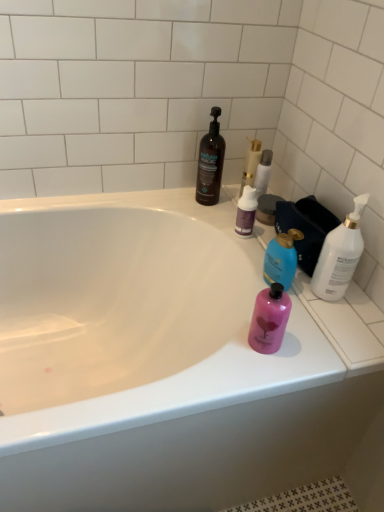
What do you see at coordinates (251, 164) in the screenshot? I see `gold metallic candle at upper center` at bounding box center [251, 164].

You are a GUI agent. You are given a task and a screenshot of the screen. Output one action in this format:
    pyautogui.click(x=<x>, y=<y>)
    Task: Click on the pink matte bottle at right, positioned as the third bottle in right-to-left order
    The image size is (384, 512).
    Given the screenshot: What is the action you would take?
    pyautogui.click(x=269, y=319)

Based on the photo, measure the distance between blue glossy bottle at upper right, the fourth bottle positioned from the left, and camera.

A distance of 39.30 inches exists between blue glossy bottle at upper right, the fourth bottle positioned from the left, and camera.

Identify the location of purple matte bottle at upper center, the fourth bottle in the right-to-left sequence. (246, 212).

In order to face silver metallic tube at upper center, should I rotate leftwards or rightwards?

You should rotate right by 9.601 degrees.

Image resolution: width=384 pixels, height=512 pixels. Describe the element at coordinates (263, 172) in the screenshot. I see `silver metallic tube at upper center` at that location.

Describe the element at coordinates (210, 163) in the screenshot. I see `dark brown plastic bottle at upper center, arranged as the first bottle when viewed from the left` at that location.

At what (x,y) coordinates should I click in order to perform the action: click on gold metallic candle at upper center. Please return your answer as a coordinate pair (x, y). Image resolution: width=384 pixels, height=512 pixels. Looking at the image, I should click on (251, 164).

Between pink matte bottle at right, positioned as the third bottle in right-to-left order, and dark brown plastic bottle at upper center, arranged as the first bottle when viewed from the left, which one has smaller size?

pink matte bottle at right, positioned as the third bottle in right-to-left order, is smaller.

In the scene shown: Is pink matte bottle at right, positioned as the third bottle in right-to-left order, facing towards dark brown plastic bottle at upper center, arranged as the first bottle when viewed from the left?

No, pink matte bottle at right, positioned as the third bottle in right-to-left order, is not turned towards dark brown plastic bottle at upper center, arranged as the first bottle when viewed from the left.

Is dark brown plastic bottle at upper center, arranged as the 5th bottle when viewed from the right, a part of pink matte bottle at right, positioned as the third bottle in right-to-left order?

No.

From the image's perspective, would you say pink matte bottle at right, marked as the third bottle in a left-to-right arrangement, is positioned over dark brown plastic bottle at upper center, arranged as the first bottle when viewed from the left?

Actually, pink matte bottle at right, marked as the third bottle in a left-to-right arrangement, appears below dark brown plastic bottle at upper center, arranged as the first bottle when viewed from the left, in the image.

Which of these two, dark brown plastic bottle at upper center, arranged as the 5th bottle when viewed from the right, or purple matte bottle at upper center, the second bottle when ordered from left to right, stands taller?

With more height is dark brown plastic bottle at upper center, arranged as the 5th bottle when viewed from the right.

Is dark brown plastic bottle at upper center, arranged as the first bottle when viewed from the left, inside the boundaries of purple matte bottle at upper center, the second bottle when ordered from left to right, or outside?

dark brown plastic bottle at upper center, arranged as the first bottle when viewed from the left, is located beyond the bounds of purple matte bottle at upper center, the second bottle when ordered from left to right.

You are a GUI agent. You are given a task and a screenshot of the screen. Output one action in this format:
    pyautogui.click(x=<x>, y=<y>)
    Task: Click on the bottle located behind the purple matte bottle at upper center, the second bottle when ordered from left to right
    This screenshot has height=512, width=384.
    Given the screenshot: What is the action you would take?
    pyautogui.click(x=210, y=163)

From a real-world perspective, is white glossy bathtub at upper center above or below blue glossy bottle at upper right, the second bottle in the right-to-left sequence?

Clearly, from a real-world perspective, white glossy bathtub at upper center is below blue glossy bottle at upper right, the second bottle in the right-to-left sequence.

This screenshot has height=512, width=384. I want to click on bathtub in front of the blue glossy bottle at upper right, the second bottle in the right-to-left sequence, so click(161, 361).

Is white glossy bathtub at upper center positioned in front of blue glossy bottle at upper right, the fourth bottle positioned from the left?

That is True.

Between white glossy bathtub at upper center and blue glossy bottle at upper right, the fourth bottle positioned from the left, which one has smaller size?

Smaller between the two is blue glossy bottle at upper right, the fourth bottle positioned from the left.

How far apart are purple matte bottle at upper center, the fourth bottle in the right-to-left sequence, and white glossy bathtub at upper center?

They are 49.32 centimeters apart.

Is purple matte bottle at upper center, the fourth bottle in the right-to-left sequence, oriented away from white glossy bathtub at upper center?

No.

From the image's perspective, which is above, purple matte bottle at upper center, the second bottle when ordered from left to right, or white glossy bathtub at upper center?

purple matte bottle at upper center, the second bottle when ordered from left to right, is shown above in the image.

The image size is (384, 512). Find the location of `bathtub that is on the left side of purple matte bottle at upper center, the second bottle when ordered from left to right`. bathtub that is on the left side of purple matte bottle at upper center, the second bottle when ordered from left to right is located at coordinates (161, 361).

Which object is closer to the camera, gold metallic candle at upper center or silver metallic tube at upper center?

silver metallic tube at upper center.

From the image's perspective, would you say gold metallic candle at upper center is positioned over silver metallic tube at upper center?

Yes, from the image's perspective, gold metallic candle at upper center is on top of silver metallic tube at upper center.

Would you say gold metallic candle at upper center is outside silver metallic tube at upper center?

Yes.

Does gold metallic candle at upper center have a larger size compared to silver metallic tube at upper center?

Yes, gold metallic candle at upper center is bigger than silver metallic tube at upper center.

Are white glossy bottle at right, the 1th bottle in the right-to-left sequence, and white glossy bathtub at upper center making contact?

No, white glossy bottle at right, the 1th bottle in the right-to-left sequence, is not next to white glossy bathtub at upper center.

Considering the relative sizes of white glossy bottle at right, which appears as the 5th bottle when viewed from the left, and white glossy bathtub at upper center in the image provided, is white glossy bottle at right, which appears as the 5th bottle when viewed from the left, taller than white glossy bathtub at upper center?

No.

The image size is (384, 512). Find the location of `bathtub lying in front of the white glossy bottle at right, which appears as the 5th bottle when viewed from the left`. bathtub lying in front of the white glossy bottle at right, which appears as the 5th bottle when viewed from the left is located at coordinates (161, 361).

Which is farther, (334, 267) or (151, 231)?

The point (151, 231) is farther from the camera.

Which object is closer to the camera, silver metallic tube at upper center or dark brown plastic bottle at upper center, arranged as the first bottle when viewed from the left?

Positioned in front is dark brown plastic bottle at upper center, arranged as the first bottle when viewed from the left.

Which object is positioned more to the right, silver metallic tube at upper center or dark brown plastic bottle at upper center, arranged as the first bottle when viewed from the left?

Positioned to the right is silver metallic tube at upper center.

Between silver metallic tube at upper center and dark brown plastic bottle at upper center, arranged as the first bottle when viewed from the left, which one has larger size?

dark brown plastic bottle at upper center, arranged as the first bottle when viewed from the left, is bigger.

From the dark brown plastic bottle at upper center, arranged as the 5th bottle when viewed from the right, count 4th bottles forward and point to it. Please provide its 2D coordinates.

[(269, 319)]

Identify the location of bottle above the purple matte bottle at upper center, the fourth bottle in the right-to-left sequence (from the image's perspective). The height and width of the screenshot is (512, 384). pos(210,163).

From the image, which object appears to be farther from pink matte bottle at right, marked as the third bottle in a left-to-right arrangement, silver metallic tube at upper center or dark brown plastic bottle at upper center, arranged as the first bottle when viewed from the left?

dark brown plastic bottle at upper center, arranged as the first bottle when viewed from the left, is further to pink matte bottle at right, marked as the third bottle in a left-to-right arrangement.

From the image, which object appears to be nearer to pink matte bottle at right, marked as the third bottle in a left-to-right arrangement, white glossy bathtub at upper center or dark brown plastic bottle at upper center, arranged as the first bottle when viewed from the left?

The object closer to pink matte bottle at right, marked as the third bottle in a left-to-right arrangement, is white glossy bathtub at upper center.

Which object lies nearer to the anchor point blue glossy bottle at upper right, the second bottle in the right-to-left sequence, white glossy bottle at right, the 1th bottle in the right-to-left sequence, or white glossy bathtub at upper center?

white glossy bottle at right, the 1th bottle in the right-to-left sequence.

From the image, which object appears to be nearer to gold metallic candle at upper center, purple matte bottle at upper center, the second bottle when ordered from left to right, or pink matte bottle at right, marked as the third bottle in a left-to-right arrangement?

The object closer to gold metallic candle at upper center is purple matte bottle at upper center, the second bottle when ordered from left to right.

Looking at the image, which one is located further to gold metallic candle at upper center, purple matte bottle at upper center, the second bottle when ordered from left to right, or blue glossy bottle at upper right, the second bottle in the right-to-left sequence?

blue glossy bottle at upper right, the second bottle in the right-to-left sequence.

Based on the photo, looking at the image, which one is located closer to white glossy bathtub at upper center, purple matte bottle at upper center, the fourth bottle in the right-to-left sequence, or silver metallic tube at upper center?

Based on the image, purple matte bottle at upper center, the fourth bottle in the right-to-left sequence, appears to be nearer to white glossy bathtub at upper center.

When comparing their distances from silver metallic tube at upper center, does white glossy bathtub at upper center or purple matte bottle at upper center, the fourth bottle in the right-to-left sequence, seem closer?

Based on the image, purple matte bottle at upper center, the fourth bottle in the right-to-left sequence, appears to be nearer to silver metallic tube at upper center.

Consider the image. Based on their spatial positions, is white glossy bottle at right, the 1th bottle in the right-to-left sequence, or silver metallic tube at upper center further from pink matte bottle at right, marked as the third bottle in a left-to-right arrangement?

Based on the image, silver metallic tube at upper center appears to be further to pink matte bottle at right, marked as the third bottle in a left-to-right arrangement.

Where is `cleaning product between dark brown plastic bottle at upper center, arranged as the first bottle when viewed from the left, and blue glossy bottle at upper right, the fourth bottle positioned from the left, vertically`? The image size is (384, 512). cleaning product between dark brown plastic bottle at upper center, arranged as the first bottle when viewed from the left, and blue glossy bottle at upper right, the fourth bottle positioned from the left, vertically is located at coordinates (251, 164).

Where is `toiletry between gold metallic candle at upper center and purple matte bottle at upper center, the second bottle when ordered from left to right, in the up-down direction`? toiletry between gold metallic candle at upper center and purple matte bottle at upper center, the second bottle when ordered from left to right, in the up-down direction is located at coordinates (263, 172).

Find the location of a particular element. Image resolution: width=384 pixels, height=512 pixels. cleaning product between dark brown plastic bottle at upper center, arranged as the 5th bottle when viewed from the right, and silver metallic tube at upper center, in the horizontal direction is located at coordinates (251, 164).

Find the location of a particular element. bottle between pink matte bottle at right, positioned as the third bottle in right-to-left order, and white glossy bottle at right, the 1th bottle in the right-to-left sequence is located at coordinates (281, 259).